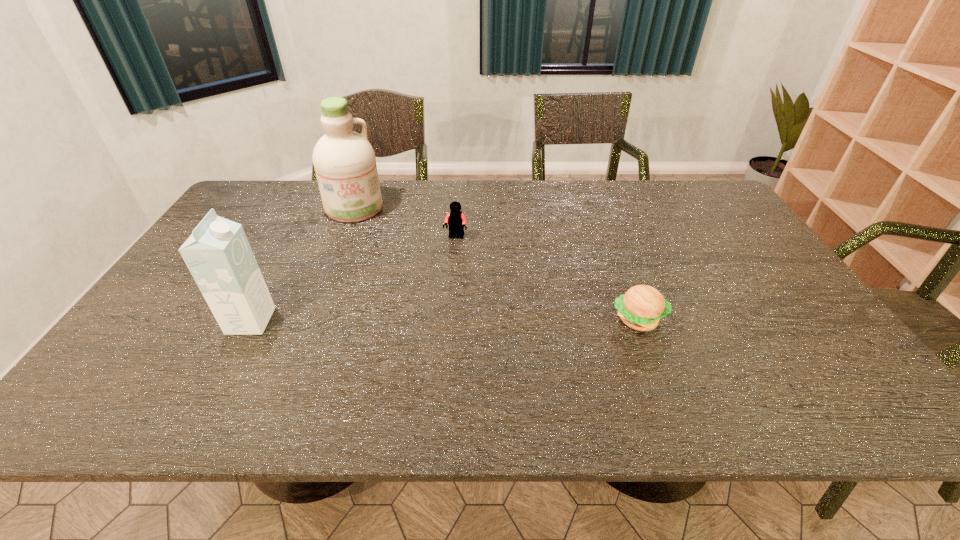
I want to click on vacant space that's between the carton and the Lego, so click(353, 279).

What are the coordinates of `free space that is in between the farthest object and the shortest object` in the screenshot? It's located at (496, 264).

The width and height of the screenshot is (960, 540). Find the location of `unoccupied position between the cleansing agent and the shortest object`. unoccupied position between the cleansing agent and the shortest object is located at coordinates (496, 264).

Identify the location of object that stands as the second closest to the third object from right to left. (217, 253).

Select which object appears as the closest to the third nearest object. Please provide its 2D coordinates. Your answer should be formatted as a tuple, i.e. [(x, y)], where the tuple contains the x and y coordinates of a point satisfying the conditions above.

[(345, 165)]

The image size is (960, 540). What are the coordinates of `free location that satisfies the following two spatial constraints: 1. on the front side of the tallest object; 2. on the left side of the third nearest object` in the screenshot? It's located at (343, 237).